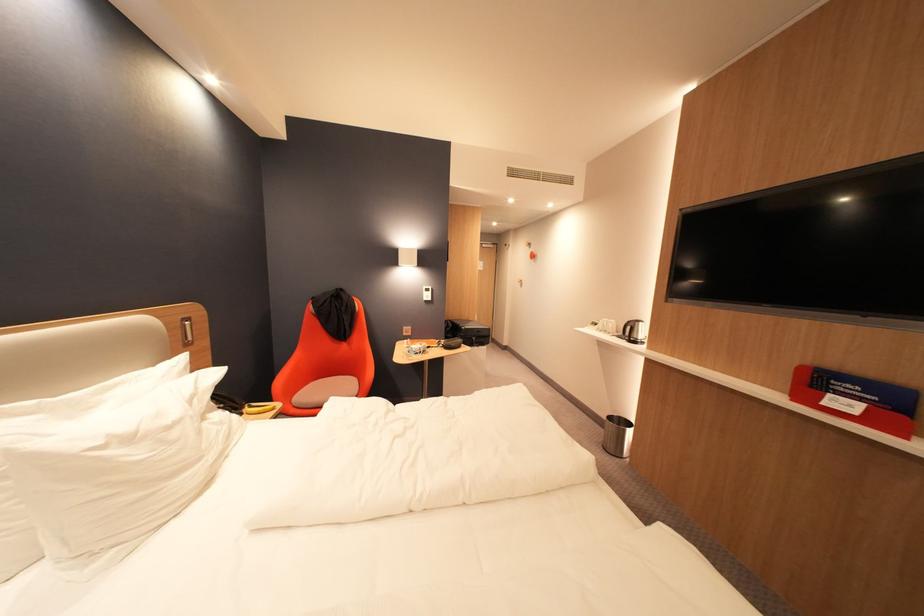
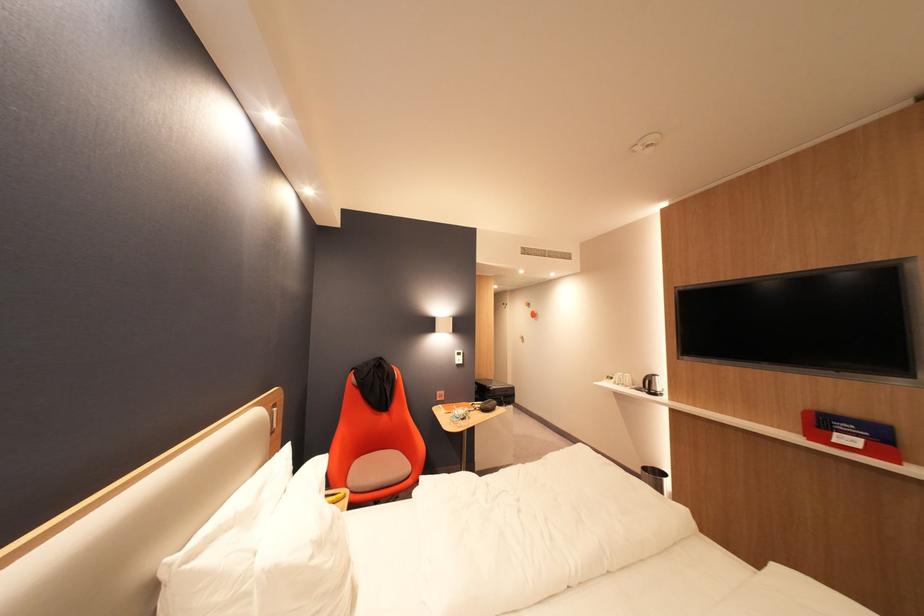
Question: In a continuous first-person perspective shot, in which direction is the camera moving?

Choices:
 (A) Left
 (B) Right
 (C) Forward
 (D) Backward

Answer: (A)